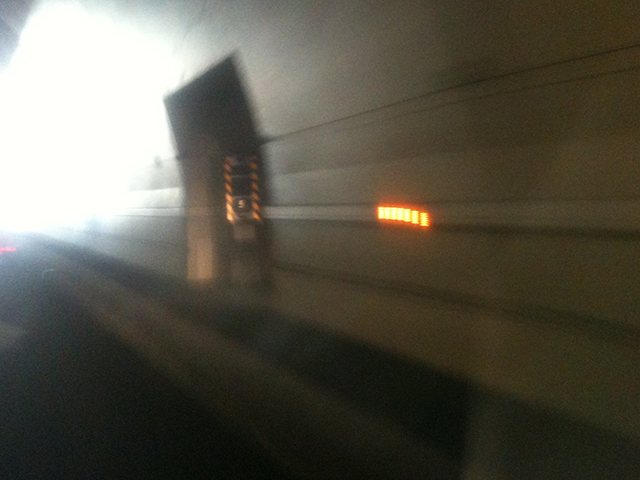
You are a GUI agent. You are given a task and a screenshot of the screen. Output one action in this format:
    pyautogui.click(x=<x>, y=<y>)
    Task: Click on the caution pattern on door
    The width and height of the screenshot is (640, 480).
    Given the screenshot: What is the action you would take?
    pyautogui.click(x=226, y=184)